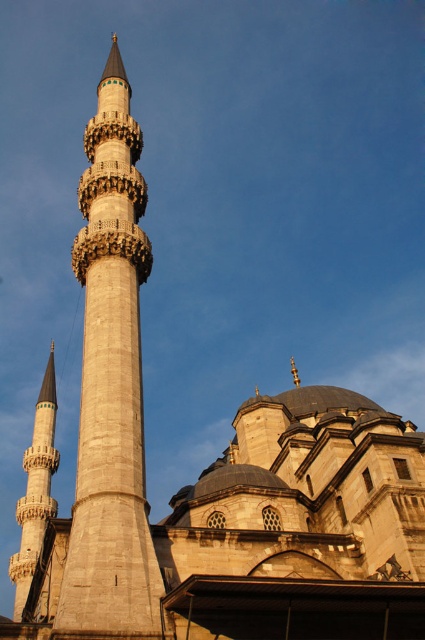
Does light beige stone minaret at center have a smaller size compared to smooth stone minaret at left?

Yes, light beige stone minaret at center is smaller than smooth stone minaret at left.

Can you confirm if light beige stone minaret at center is bigger than smooth stone minaret at left?

No, light beige stone minaret at center is not bigger than smooth stone minaret at left.

Is point (116, 122) closer to camera compared to point (11, 564)?

Yes, it is.

Find the location of `light beige stone minaret at center`. light beige stone minaret at center is located at coordinates (110, 387).